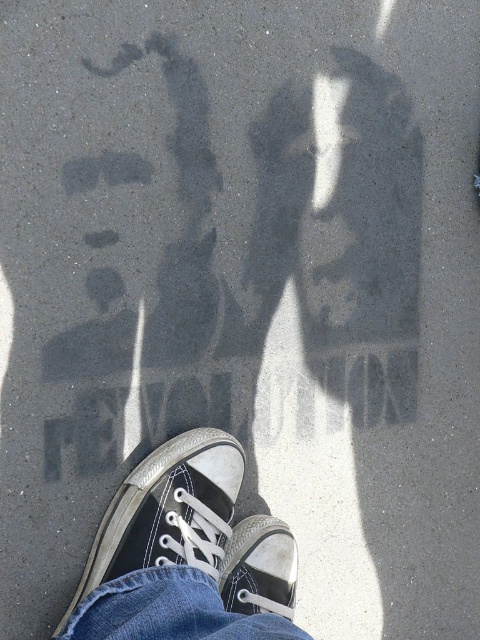
From the picture: You are a photographer analyzing the scene. You notice the black canvas shoe at lower center and the black canvas shoe at center. Based on their positions, which one is closer to the camera?

The black canvas shoe at lower center is above the black canvas shoe at center, so it is closer to the camera.

Based on the photo, you are a photographer taking a picture of the black canvas shoe at lower center and the black canvas shoe at center. Which shoe should you focus on if you want to capture the one that appears larger in the photo?

The black canvas shoe at lower center appears much taller than the black canvas shoe at center, so you should focus on the black canvas shoe at lower center to capture the larger one.